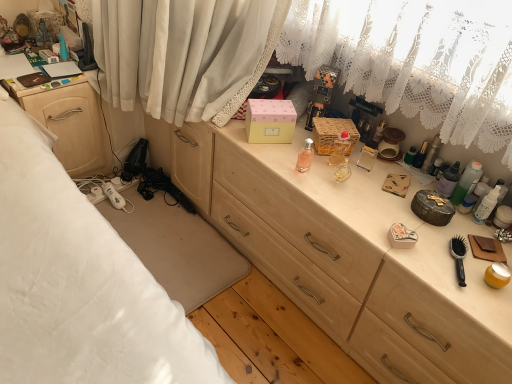
This screenshot has width=512, height=384. Identify the location of free spot to the left of translucent plastic bottles at right, which ranks as the third toiletry in left-to-right order. (401, 191).